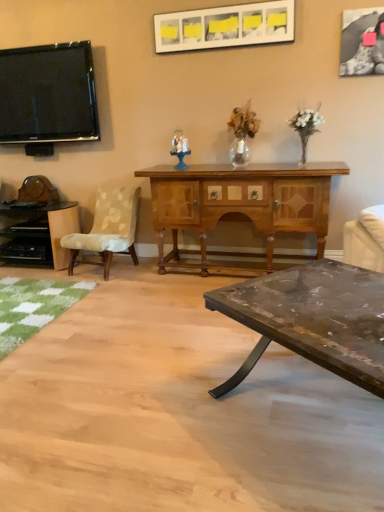
Question: Can white glossy picture frame at upper center, acting as the 1th picture frame starting from the left, be found inside flat screen tv at upper left?

Choices:
 (A) yes
 (B) no

Answer: (B)

Question: Is flat screen tv at upper left closer to camera compared to white glossy picture frame at upper center, acting as the 1th picture frame starting from the left?

Choices:
 (A) yes
 (B) no

Answer: (B)

Question: Is flat screen tv at upper left further to the viewer compared to white glossy picture frame at upper center, arranged as the 2th picture frame when viewed from the right?

Choices:
 (A) yes
 (B) no

Answer: (A)

Question: Is flat screen tv at upper left aimed at white glossy picture frame at upper center, acting as the 1th picture frame starting from the left?

Choices:
 (A) yes
 (B) no

Answer: (B)

Question: Is flat screen tv at upper left thinner than white glossy picture frame at upper center, acting as the 1th picture frame starting from the left?

Choices:
 (A) no
 (B) yes

Answer: (A)

Question: From a real-world perspective, is flat screen tv at upper left on white glossy picture frame at upper center, acting as the 1th picture frame starting from the left?

Choices:
 (A) yes
 (B) no

Answer: (B)

Question: Considering the relative sizes of flat screen tv at upper left and rustic wood coffee table at lower right in the image provided, is flat screen tv at upper left smaller than rustic wood coffee table at lower right?

Choices:
 (A) yes
 (B) no

Answer: (A)

Question: Can you confirm if flat screen tv at upper left is shorter than rustic wood coffee table at lower right?

Choices:
 (A) yes
 (B) no

Answer: (B)

Question: Is flat screen tv at upper left to the right of rustic wood coffee table at lower right from the viewer's perspective?

Choices:
 (A) yes
 (B) no

Answer: (B)

Question: From a real-world perspective, is flat screen tv at upper left under rustic wood coffee table at lower right?

Choices:
 (A) yes
 (B) no

Answer: (B)

Question: Is flat screen tv at upper left further to camera compared to rustic wood coffee table at lower right?

Choices:
 (A) no
 (B) yes

Answer: (B)

Question: Is flat screen tv at upper left positioned with its back to rustic wood coffee table at lower right?

Choices:
 (A) yes
 (B) no

Answer: (B)

Question: Is wooden cabinet at center, which is counted as the 1th desk, starting from the right, at the right side of black textured fabric picture frame at upper right, positioned as the 1th picture frame in right-to-left order?

Choices:
 (A) no
 (B) yes

Answer: (A)